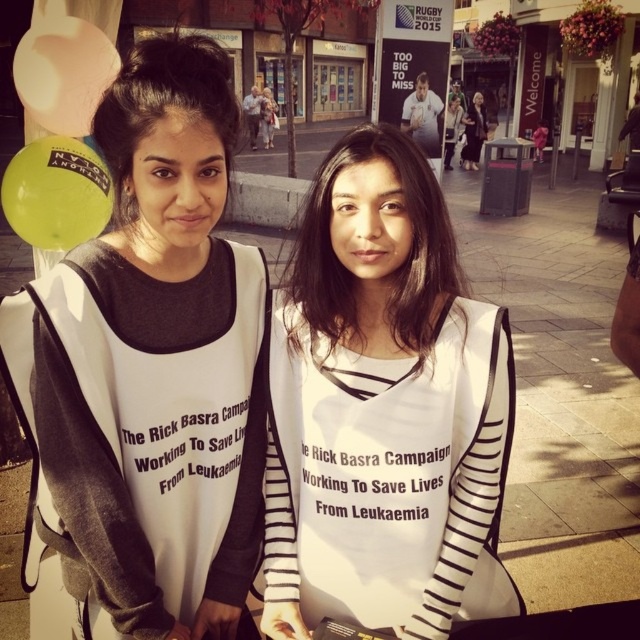
You are a photographer trying to capture a photo of the white striped shirt at center and the black matte hair at upper left. Which object should you focus on first if you want to ensure both are in the frame without moving the camera?

The white striped shirt at center has a larger width than the black matte hair at upper left, so focusing on the white striped shirt at center first would ensure both are in the frame since it occupies more space.

You are a photographer trying to capture a clear shot of the white striped shirt at center and the black matte hair at upper left. Since you want to ensure both are visible, which object should you focus on first considering their sizes?

The white striped shirt at center has a greater height compared to the black matte hair at upper left, so you should focus on the white striped shirt at center first as it is larger and more prominent.